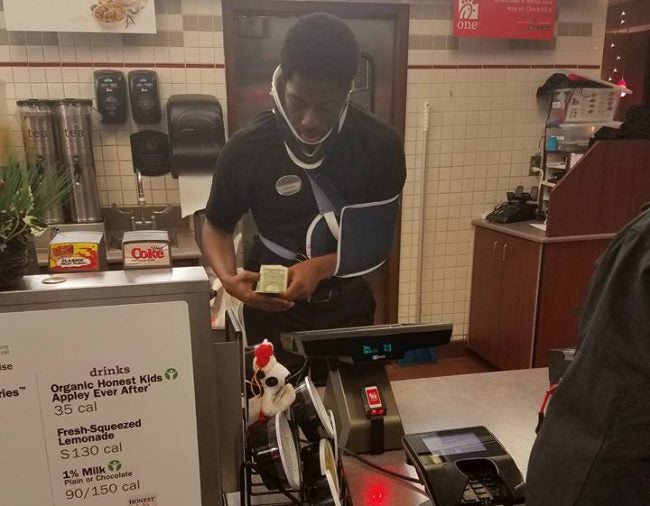
The height and width of the screenshot is (506, 650). I want to click on white tile wall, so click(x=467, y=161).